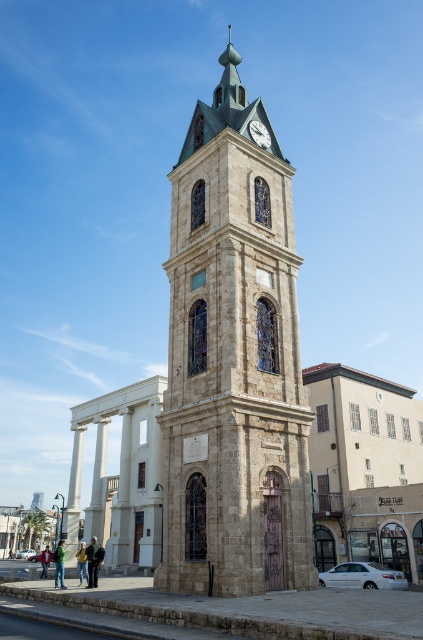
You are standing in the public square and notice two pillars near the base of the historic stone clock tower. The pillars are labeled as the white marble pillar at lower left and the white stone pillar at lower left. Which pillar is closer to the ground?

The white marble pillar at lower left is positioned under the white stone pillar at lower left, so the white marble pillar at lower left is closer to the ground.

You are standing in the public square facing the historic stone clock tower. You notice a white marble pillar at lower left and a dark gray stone clock at upper center. Which object is positioned to the left of the other?

The white marble pillar at lower left is positioned to the left of the dark gray stone clock at upper center.

You are standing in the public square facing the historic stone clock tower. You see the white stone pillar at lower left and the dark gray stone clock at upper center. Which object is located to the left of the other?

The white stone pillar at lower left is positioned on the left side of dark gray stone clock at upper center.